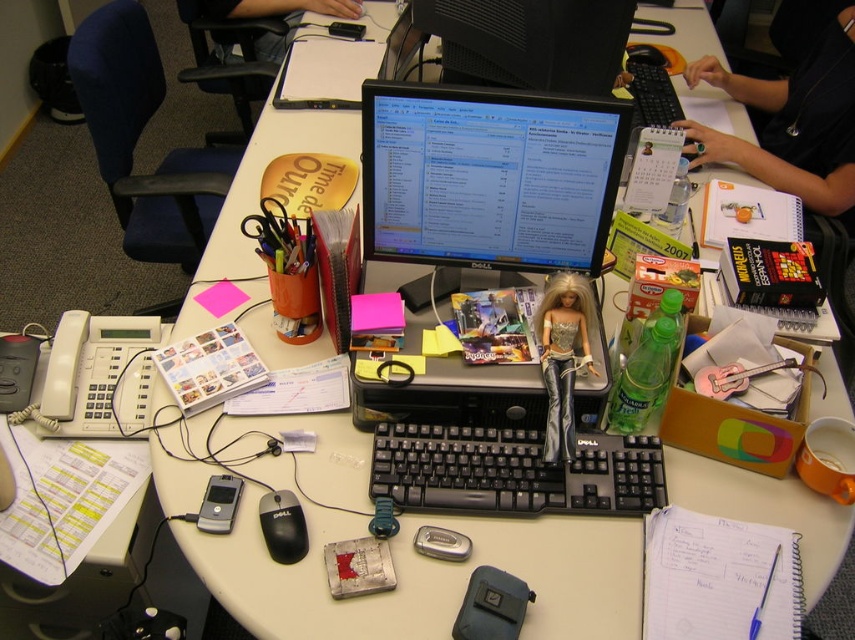
Does black glossy monitor at upper center lie behind smooth skin hand at upper center?

No.

Looking at this image, who is more forward, (516, 56) or (239, 1)?

Point (516, 56) is in front.

In order to click on black glossy monitor at upper center in this screenshot , I will do `click(528, 42)`.

Between point (382, 588) and point (293, 522), which one is positioned in front?

Point (382, 588) is in front.

Is metallic silver badge at center positioned before black plastic mouse at center?

That is True.

Find the location of a particular element. metallic silver badge at center is located at coordinates (358, 566).

At what (x,y) coordinates should I click in order to perform the action: click on metallic silver badge at center. Please return your answer as a coordinate pair (x, y). Looking at the image, I should click on (358, 566).

Between brushed metal usb drive at center and blue plastic pen at lower right, which one is positioned lower?

blue plastic pen at lower right is below.

Can you confirm if brushed metal usb drive at center is wider than blue plastic pen at lower right?

Incorrect, brushed metal usb drive at center's width does not surpass blue plastic pen at lower right's.

Which is behind, point (452, 561) or point (765, 595)?

The point (452, 561) is behind.

Find the location of a particular element. brushed metal usb drive at center is located at coordinates (441, 544).